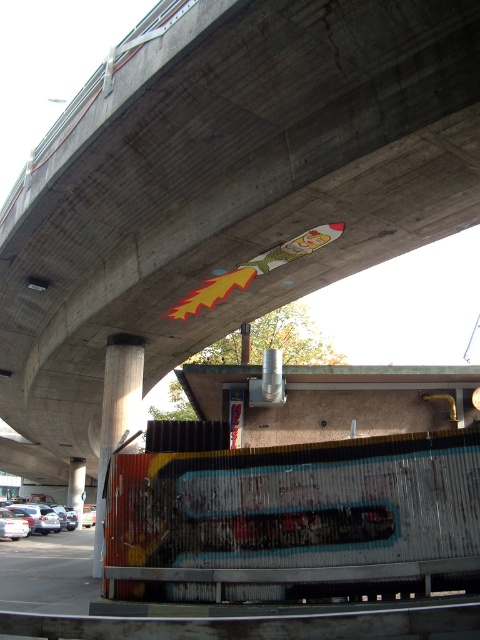
Question: Does rusty metal pillar at lower left appear on the right side of silver metallic car at lower left?

Choices:
 (A) yes
 (B) no

Answer: (A)

Question: Considering the real-world distances, which object is farthest from the rusty metal pillar at lower left?

Choices:
 (A) concrete pillar at center
 (B) silver metallic car at lower left

Answer: (A)

Question: Observing the image, what is the correct spatial positioning of rusty metal pillar at lower left in reference to concrete pillar at center?

Choices:
 (A) above
 (B) below

Answer: (A)

Question: Estimate the real-world distances between objects in this image. Which object is farther from the concrete pillar at center?

Choices:
 (A) rusty metal pillar at lower left
 (B) silver metallic car at lower left

Answer: (A)

Question: Is silver metallic car at lower left below concrete pillar at center?

Choices:
 (A) yes
 (B) no

Answer: (A)

Question: Which of the following is the closest to the observer?

Choices:
 (A) (80, 520)
 (B) (67, 520)
 (C) (140, 416)

Answer: (C)